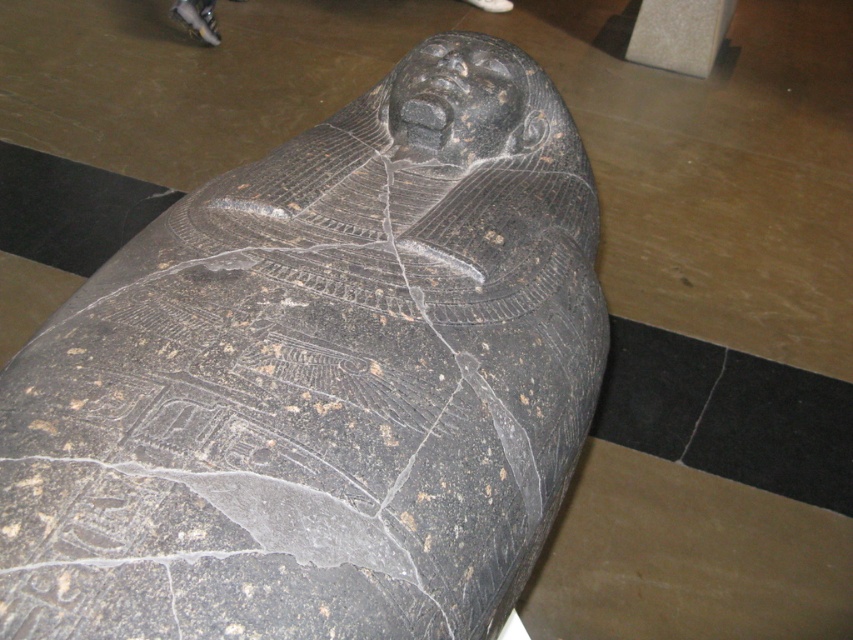
You are an archaeologist examining the ancient stone sarcophagus. You notice the smooth gray stone at upper right and the black stone crack at lower right. Which of these two features is bigger in size?

The smooth gray stone at upper right is larger in size compared to the black stone crack at lower right.

You are an archaeologist examining the black stone sarcophagus at center and the black stone crack at lower right. Which object is located to the right of the other?

The black stone sarcophagus at center is positioned on the left side of black stone crack at lower right, meaning the crack is to the right of the sarcophagus.

You are an archaeologist examining the ancient stone sarcophagus. You notice two features on its surface. One is the smooth gray stone at upper right and the other is the black stone crack at lower right. Based on their positions, which one is higher up on the sarcophagus?

The smooth gray stone at upper right is higher up on the sarcophagus than the black stone crack at lower right.